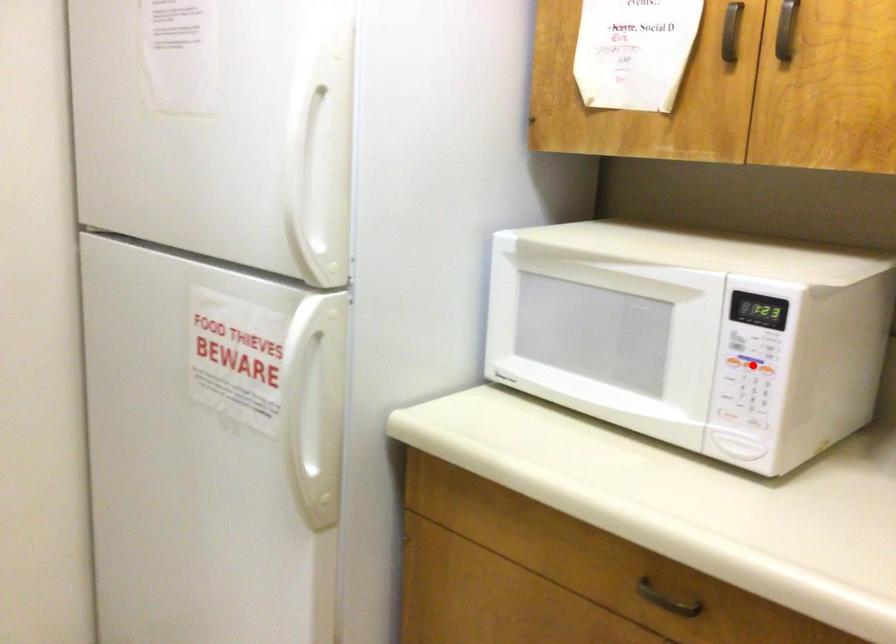
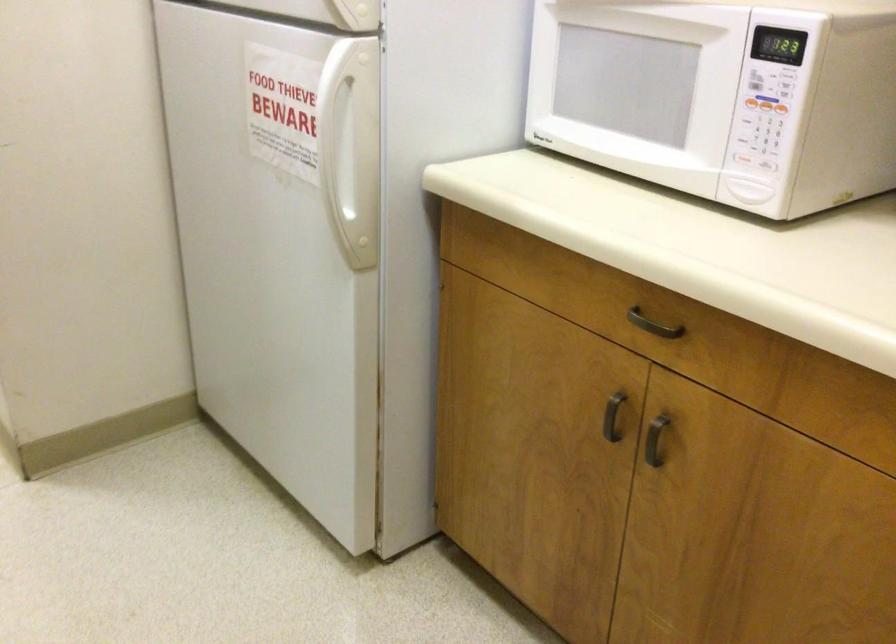
Locate, in the second image, the point that corresponds to the highlighted location in the first image.

(765, 104)